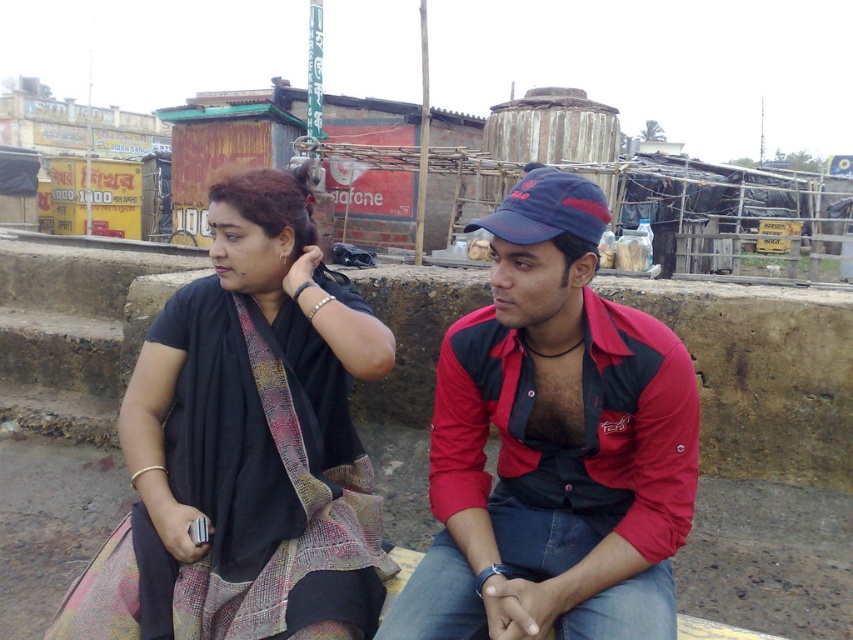
Question: In this image, where is red fabric shirt at center located relative to black woven sari at left?

Choices:
 (A) left
 (B) right

Answer: (B)

Question: In this image, where is red fabric shirt at center located relative to black woven sari at left?

Choices:
 (A) right
 (B) left

Answer: (A)

Question: Is red fabric shirt at center further to the viewer compared to black woven sari at left?

Choices:
 (A) yes
 (B) no

Answer: (B)